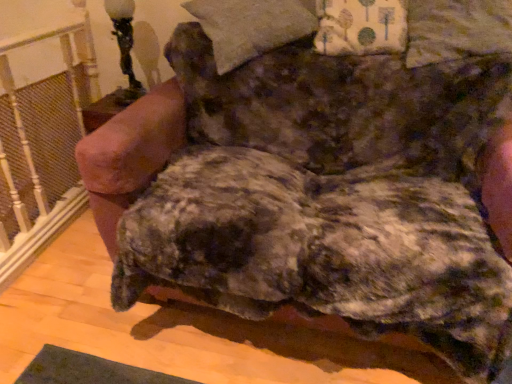
Question: Would you consider floral fabric pillow at upper right, the second pillow when ordered from left to right, to be distant from fluffy beige pillow at upper center, which is the 2th pillow from right to left?

Choices:
 (A) no
 (B) yes

Answer: (A)

Question: From a real-world perspective, does floral fabric pillow at upper right, the second pillow when ordered from left to right, sit lower than fluffy beige pillow at upper center, the first pillow from the left?

Choices:
 (A) no
 (B) yes

Answer: (A)

Question: Would you say floral fabric pillow at upper right, the second pillow when ordered from left to right, is outside fluffy beige pillow at upper center, which is the 2th pillow from right to left?

Choices:
 (A) no
 (B) yes

Answer: (B)

Question: Is the surface of floral fabric pillow at upper right, the second pillow when ordered from left to right, in direct contact with fluffy beige pillow at upper center, the first pillow from the left?

Choices:
 (A) yes
 (B) no

Answer: (B)

Question: Is floral fabric pillow at upper right, arranged as the 1th pillow when viewed from the right, to the right of fluffy beige pillow at upper center, which is the 2th pillow from right to left, from the viewer's perspective?

Choices:
 (A) no
 (B) yes

Answer: (B)

Question: Is black glass table lamp at upper left in front of or behind floral fabric pillow at upper right, arranged as the 1th pillow when viewed from the right, in the image?

Choices:
 (A) behind
 (B) front

Answer: (A)

Question: In terms of width, does black glass table lamp at upper left look wider or thinner when compared to floral fabric pillow at upper right, arranged as the 1th pillow when viewed from the right?

Choices:
 (A) thin
 (B) wide

Answer: (A)

Question: From the image's perspective, is black glass table lamp at upper left positioned above or below floral fabric pillow at upper right, arranged as the 1th pillow when viewed from the right?

Choices:
 (A) above
 (B) below

Answer: (A)

Question: From a real-world perspective, is black glass table lamp at upper left positioned above or below floral fabric pillow at upper right, the second pillow when ordered from left to right?

Choices:
 (A) below
 (B) above

Answer: (A)

Question: From the image's perspective, is fluffy brown dog at center located above or below white painted wood at left?

Choices:
 (A) above
 (B) below

Answer: (B)

Question: Considering the positions of point pos(392,264) and point pos(4,268), is point pos(392,264) closer or farther from the camera than point pos(4,268)?

Choices:
 (A) closer
 (B) farther

Answer: (A)

Question: Is fluffy brown dog at center in front of or behind white painted wood at left in the image?

Choices:
 (A) front
 (B) behind

Answer: (A)

Question: Considering the relative positions of fluffy brown dog at center and white painted wood at left in the image provided, is fluffy brown dog at center to the left or to the right of white painted wood at left?

Choices:
 (A) left
 (B) right

Answer: (B)

Question: Is fluffy beige pillow at upper center, the first pillow from the left, inside the boundaries of black glass table lamp at upper left, or outside?

Choices:
 (A) outside
 (B) inside

Answer: (A)

Question: From their relative heights in the image, would you say fluffy beige pillow at upper center, which is the 2th pillow from right to left, is taller or shorter than black glass table lamp at upper left?

Choices:
 (A) tall
 (B) short

Answer: (B)